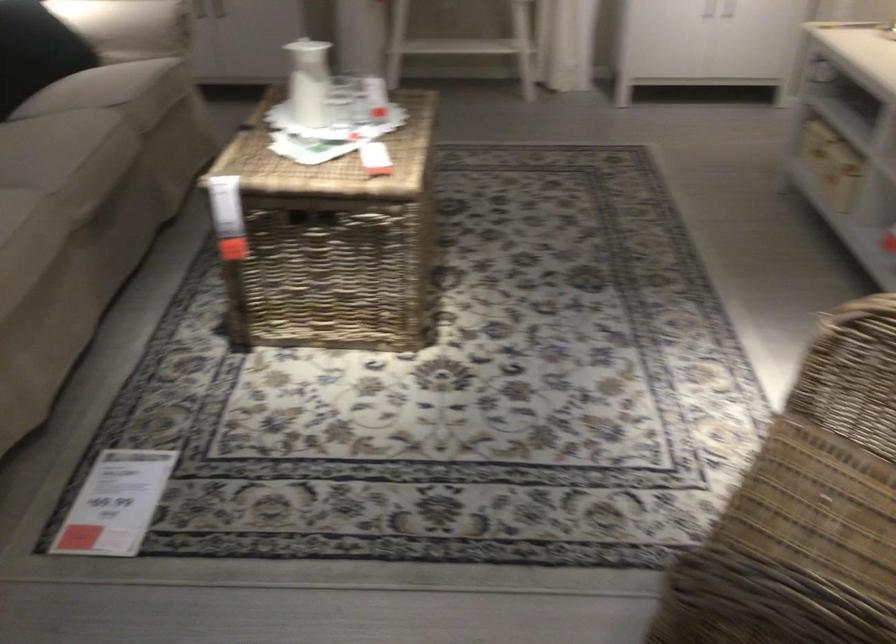
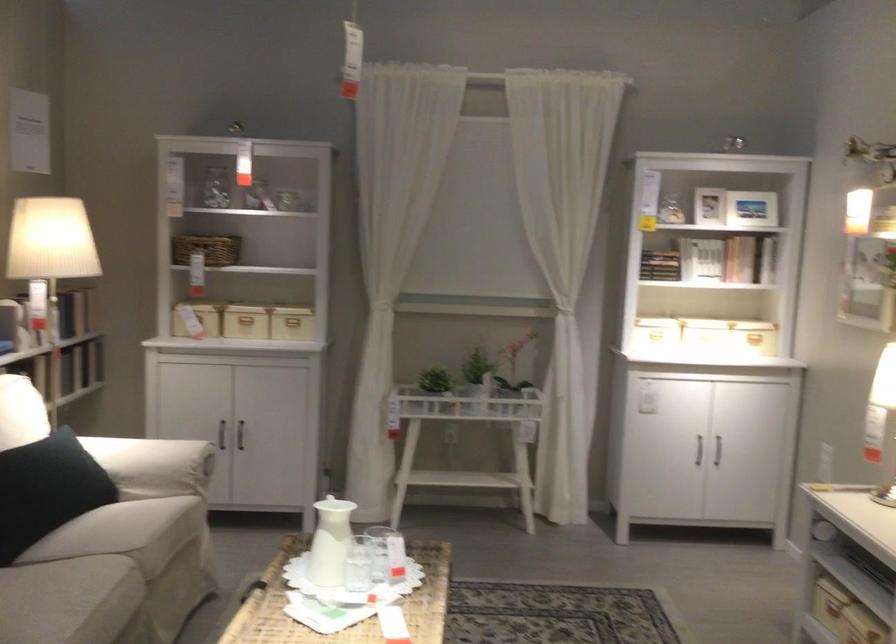
The point at (307, 77) is marked in the first image. Where is the corresponding point in the second image?

(330, 542)